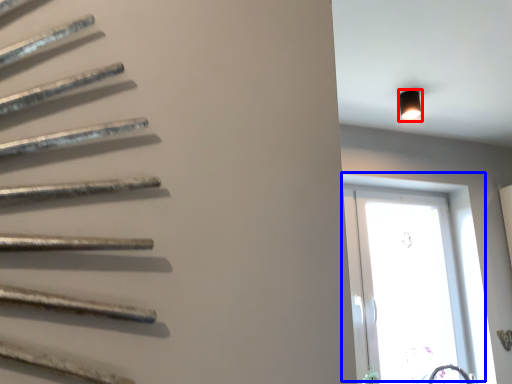
Question: Which point is further to the camera, light fixture (highlighted by a red box) or window (highlighted by a blue box)?

Choices:
 (A) light fixture
 (B) window

Answer: (B)